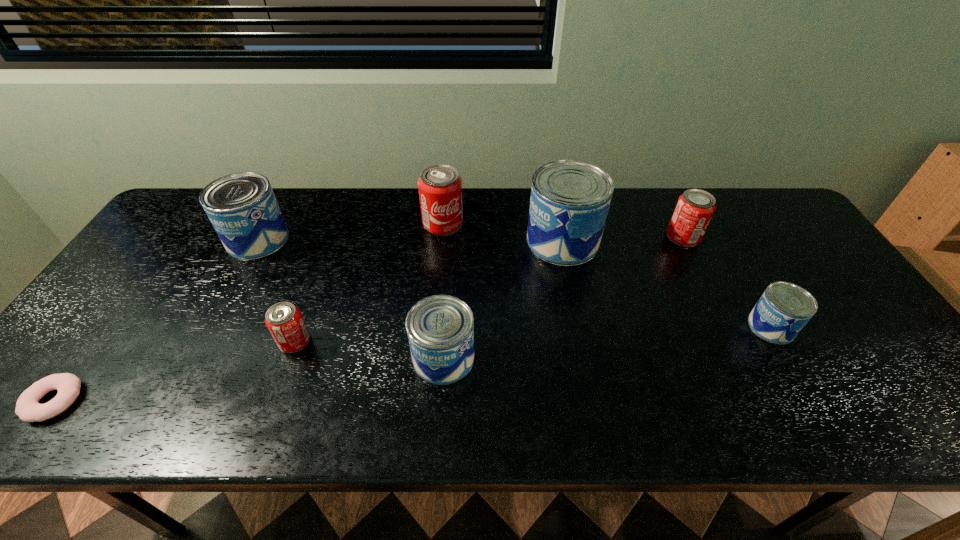
At what (x,y) coordinates should I click in order to perform the action: click on blue can that is the nearest to the leftmost can. Please return your answer as a coordinate pair (x, y). Looking at the image, I should click on (440, 328).

Find the location of a particular element. the second closest red can to the biggest blue can is located at coordinates (695, 207).

The height and width of the screenshot is (540, 960). I want to click on red can that is the closest to the shortest object, so click(x=284, y=321).

Identify the location of vacant point that satisfies the following two spatial constraints: 1. on the front label of the leftmost blue can; 2. on the back side of the leftmost red can. Image resolution: width=960 pixels, height=540 pixels. (204, 341).

Locate an element on the screen. Image resolution: width=960 pixels, height=540 pixels. free point that satisfies the following two spatial constraints: 1. on the front side of the biggest red can; 2. on the front label of the seventh object from right to left is located at coordinates tap(442, 239).

Identify the location of blank area in the image that satisfies the following two spatial constraints: 1. on the back side of the sixth can from right to left; 2. on the left side of the second smallest red can. (332, 237).

This screenshot has height=540, width=960. What are the coordinates of `vacant area in the image that satisfies the following two spatial constraints: 1. on the front side of the sixth can from left to right; 2. on the front label of the second blue can from left to right` in the screenshot? It's located at (742, 358).